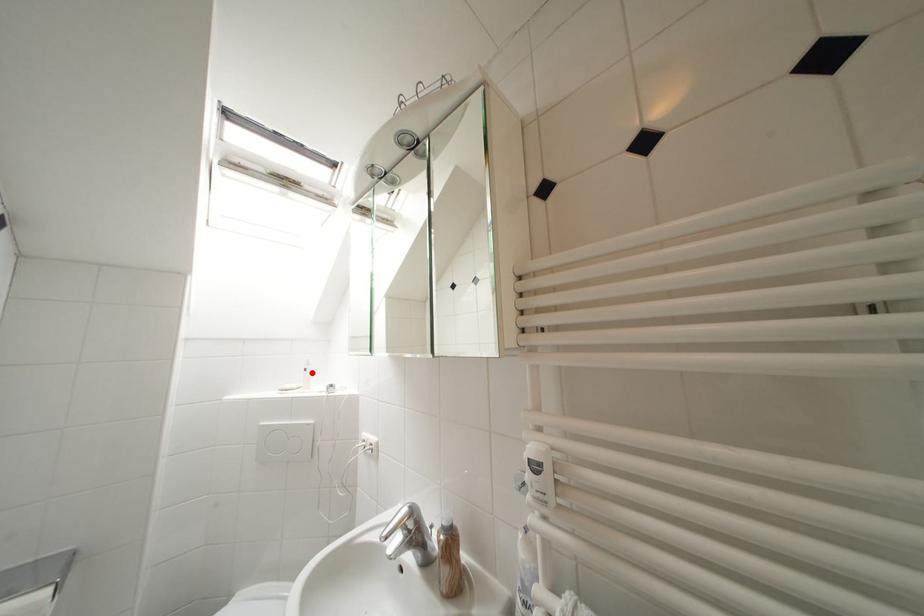
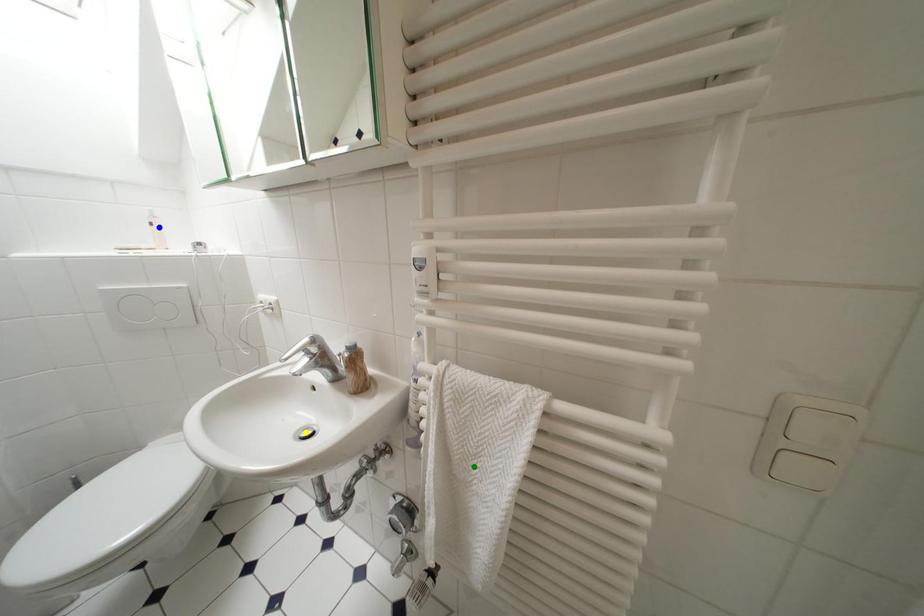
Question: I am providing you with two images of the same scene from different viewpoints. A red point is marked on the first image. You are given multiple points on the second image. Which point in image 2 represents the same 3d spot as the red point in image 1?

Choices:
 (A) yellow point
 (B) blue point
 (C) green point

Answer: (B)